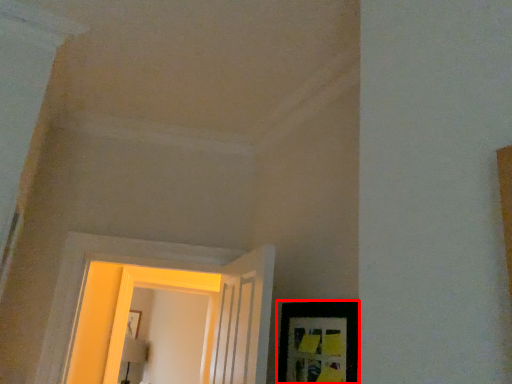
Question: From the image's perspective, where is picture frame (annotated by the red box) located relative to window?

Choices:
 (A) above
 (B) below

Answer: (A)